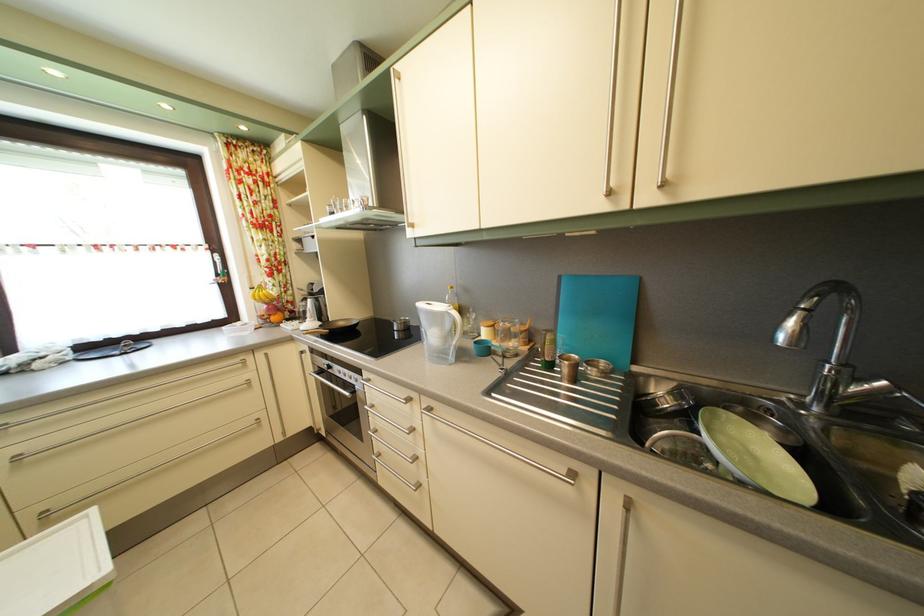
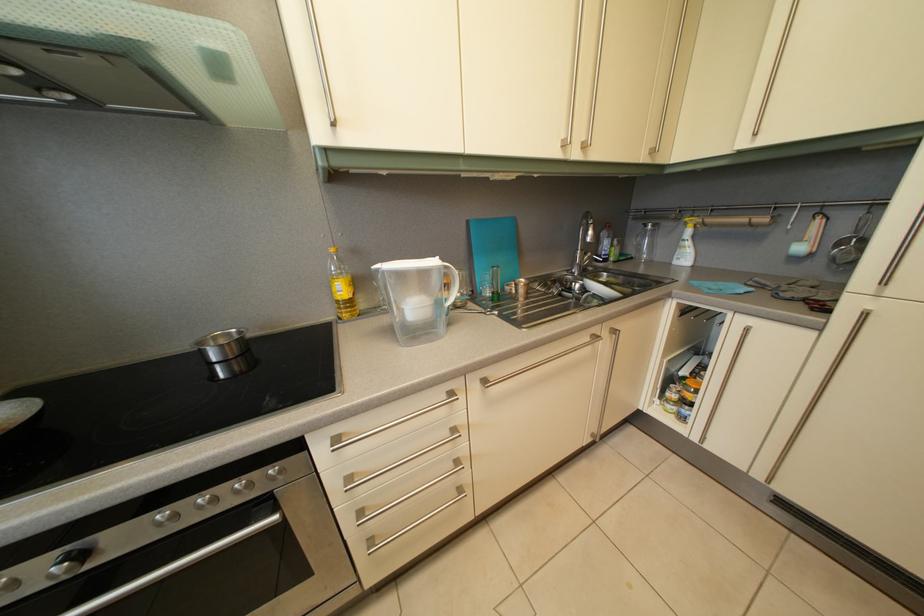
Question: How did the camera likely rotate?

Choices:
 (A) Left
 (B) Right
 (C) Up
 (D) Down

Answer: (B)